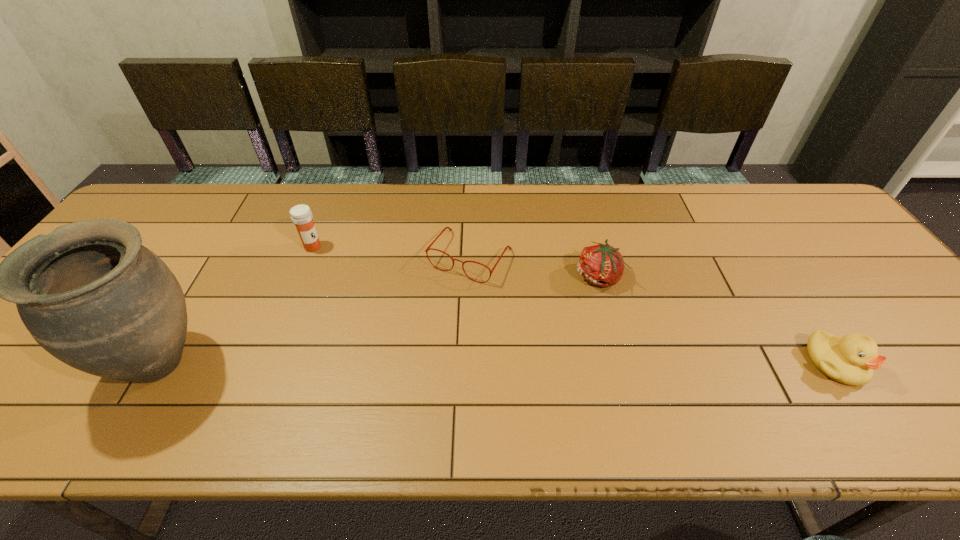
At what (x,y) coordinates should I click in order to perform the action: click on duckling located in the near edge section of the desktop. Please return your answer as a coordinate pair (x, y). The width and height of the screenshot is (960, 540). Looking at the image, I should click on (850, 360).

The image size is (960, 540). What are the coordinates of `free spot at the far edge of the desktop` in the screenshot? It's located at (657, 214).

Locate an element on the screen. vacant space at the near edge is located at coordinates (812, 384).

The width and height of the screenshot is (960, 540). I want to click on blank area at the right edge, so click(x=888, y=308).

The image size is (960, 540). What are the coordinates of `vacant region at the far left corner of the desktop` in the screenshot? It's located at (143, 227).

Identify the location of vacant area at the near right corner of the desktop. (955, 375).

Image resolution: width=960 pixels, height=540 pixels. Find the location of `unoccupied position between the rightmost object and the fourth object from left to right`. unoccupied position between the rightmost object and the fourth object from left to right is located at coordinates (716, 320).

Locate an element on the screen. vacant point located between the leftmost object and the third object from left to right is located at coordinates (316, 310).

Identify the location of unoccupied area between the fourth object from left to right and the tallest object. (380, 319).

The width and height of the screenshot is (960, 540). Identify the location of unoccupied area between the fourth object from right to left and the tallest object. (237, 305).